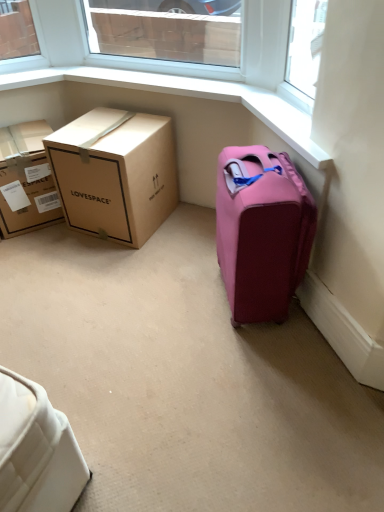
Question: Considering the relative sizes of clear glass window at upper center and pink fabric suitcase at right in the image provided, is clear glass window at upper center shorter than pink fabric suitcase at right?

Choices:
 (A) yes
 (B) no

Answer: (A)

Question: Is clear glass window at upper center positioned before pink fabric suitcase at right?

Choices:
 (A) no
 (B) yes

Answer: (A)

Question: From the image's perspective, is clear glass window at upper center over pink fabric suitcase at right?

Choices:
 (A) yes
 (B) no

Answer: (A)

Question: Is pink fabric suitcase at right surrounded by clear glass window at upper center?

Choices:
 (A) no
 (B) yes

Answer: (A)

Question: Is clear glass window at upper center bigger than pink fabric suitcase at right?

Choices:
 (A) no
 (B) yes

Answer: (A)

Question: Considering the relative sizes of clear glass window at upper center and pink fabric suitcase at right in the image provided, is clear glass window at upper center taller than pink fabric suitcase at right?

Choices:
 (A) yes
 (B) no

Answer: (B)

Question: Is clear glass window at upper center to the left of brown cardboard box at left, which is counted as the first box, starting from the right, from the viewer's perspective?

Choices:
 (A) no
 (B) yes

Answer: (A)

Question: Is the position of clear glass window at upper center more distant than that of brown cardboard box at left, which is counted as the first box, starting from the right?

Choices:
 (A) no
 (B) yes

Answer: (A)

Question: Could you tell me if clear glass window at upper center is turned towards brown cardboard box at left, which is counted as the first box, starting from the right?

Choices:
 (A) yes
 (B) no

Answer: (B)

Question: Would you say clear glass window at upper center contains brown cardboard box at left, placed as the second box when sorted from left to right?

Choices:
 (A) no
 (B) yes

Answer: (A)

Question: Is clear glass window at upper center to the right of brown cardboard box at left, which is counted as the first box, starting from the right, from the viewer's perspective?

Choices:
 (A) yes
 (B) no

Answer: (A)

Question: Considering the relative sizes of clear glass window at upper center and brown cardboard box at left, placed as the second box when sorted from left to right, in the image provided, is clear glass window at upper center bigger than brown cardboard box at left, placed as the second box when sorted from left to right,?

Choices:
 (A) yes
 (B) no

Answer: (B)

Question: Is clear glass window at upper center positioned beyond the bounds of brown cardboard box at left, which appears as the first box when viewed from the left?

Choices:
 (A) yes
 (B) no

Answer: (A)